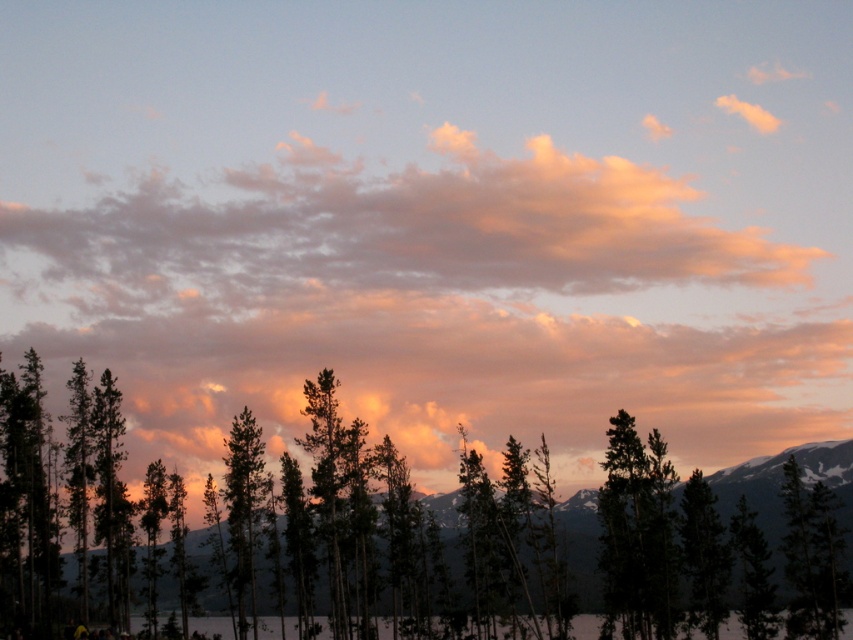
Between point (32, 449) and point (241, 513), which one is positioned in front?

Point (32, 449)

Where is `dark green textured tree at center`? The height and width of the screenshot is (640, 853). dark green textured tree at center is located at coordinates (367, 538).

Can you confirm if matte orange cloud at upper center is bigger than soft pink cotton clouds at upper center?

Correct, matte orange cloud at upper center is larger in size than soft pink cotton clouds at upper center.

This screenshot has width=853, height=640. Identify the location of matte orange cloud at upper center. (463, 284).

Does matte orange cloud at upper center have a larger size compared to green matte tree at center?

Correct, matte orange cloud at upper center is larger in size than green matte tree at center.

Looking at this image, which is more to the right, matte orange cloud at upper center or green matte tree at center?

From the viewer's perspective, matte orange cloud at upper center appears more on the right side.

Does point (448, 381) come farther from viewer compared to point (253, 429)?

Yes, point (448, 381) is farther from viewer.

Locate an element on the screen. matte orange cloud at upper center is located at coordinates (463, 284).